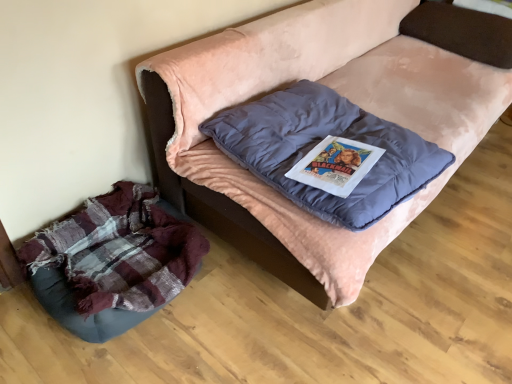
Question: From the image's perspective, is velvet pink couch at center under velvet blue pillow at upper right, which is the second pillow in left-to-right order?

Choices:
 (A) yes
 (B) no

Answer: (A)

Question: Does velvet pink couch at center have a lesser height compared to velvet blue pillow at upper right, the 2th pillow positioned from the bottom?

Choices:
 (A) no
 (B) yes

Answer: (A)

Question: Considering the relative positions of velvet pink couch at center and velvet blue pillow at upper right, the 2th pillow positioned from the bottom, in the image provided, is velvet pink couch at center in front of velvet blue pillow at upper right, the 2th pillow positioned from the bottom,?

Choices:
 (A) no
 (B) yes

Answer: (B)

Question: Could velvet blue pillow at upper right, which appears as the 1th pillow when viewed from the right, be considered to be inside velvet pink couch at center?

Choices:
 (A) no
 (B) yes

Answer: (B)

Question: Is velvet pink couch at center outside of velvet blue pillow at upper right, which ranks as the second pillow in front-to-back order?

Choices:
 (A) no
 (B) yes

Answer: (B)

Question: Is velvet pink couch at center turned away from velvet blue pillow at upper right, which ranks as the second pillow in front-to-back order?

Choices:
 (A) yes
 (B) no

Answer: (B)

Question: Considering the relative positions of velvet blue pillow at upper right, the 2th pillow positioned from the bottom, and plaid fabric dog bed at lower left in the image provided, is velvet blue pillow at upper right, the 2th pillow positioned from the bottom, to the left of plaid fabric dog bed at lower left from the viewer's perspective?

Choices:
 (A) no
 (B) yes

Answer: (A)

Question: Can you confirm if velvet blue pillow at upper right, which is the second pillow in left-to-right order, is taller than plaid fabric dog bed at lower left?

Choices:
 (A) no
 (B) yes

Answer: (A)

Question: From the image's perspective, would you say velvet blue pillow at upper right, the 2th pillow positioned from the bottom, is shown under plaid fabric dog bed at lower left?

Choices:
 (A) yes
 (B) no

Answer: (B)

Question: Is velvet blue pillow at upper right, the 2th pillow positioned from the bottom, bigger than plaid fabric dog bed at lower left?

Choices:
 (A) no
 (B) yes

Answer: (A)

Question: Considering the relative sizes of velvet blue pillow at upper right, which is the second pillow in left-to-right order, and plaid fabric dog bed at lower left in the image provided, is velvet blue pillow at upper right, which is the second pillow in left-to-right order, smaller than plaid fabric dog bed at lower left?

Choices:
 (A) yes
 (B) no

Answer: (A)

Question: Could you tell me if velvet blue pillow at upper right, the 1th pillow viewed from the back, is turned towards plaid fabric dog bed at lower left?

Choices:
 (A) no
 (B) yes

Answer: (A)

Question: Does velvet pink couch at center turn towards plaid fabric dog bed at lower left?

Choices:
 (A) yes
 (B) no

Answer: (B)